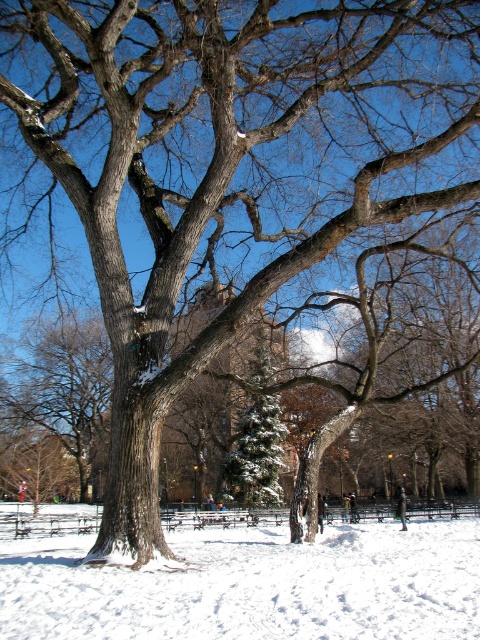
You are a hiker trying to find a clear path through the winter park scene. You see the white powdery snow at center and the green snowy evergreen at center. Which object is closer to the ground?

The white powdery snow at center is located below green snowy evergreen at center, so it is closer to the ground.

You are a winter explorer standing in the park and see the white powdery snow at center and the green snowy evergreen at center. Which object is located to the left of the other?

The white powdery snow at center is positioned on the left side of green snowy evergreen at center.